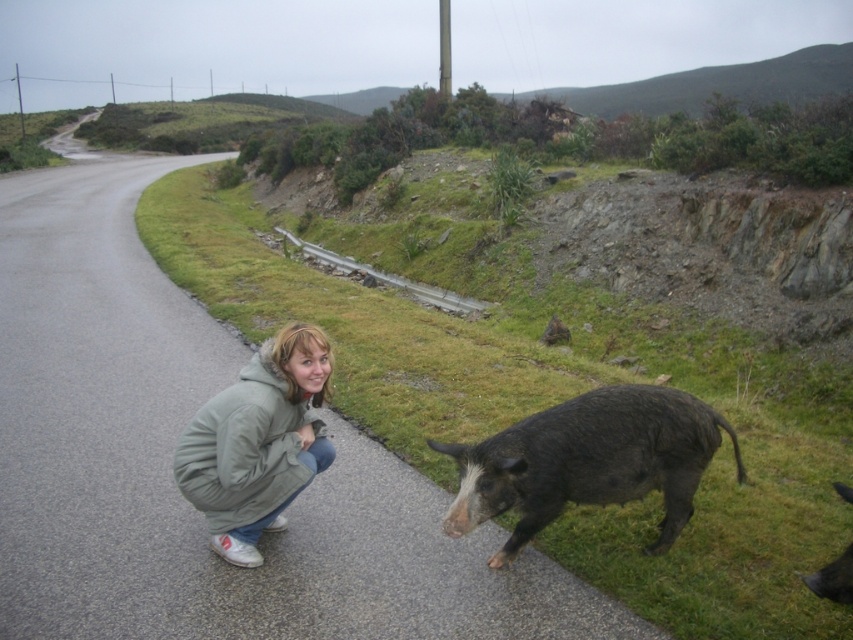
Question: Does green fuzzy jacket at lower left have a greater width compared to dark brown fur at lower right?

Choices:
 (A) no
 (B) yes

Answer: (B)

Question: Among these points, which one is nearest to the camera?

Choices:
 (A) (820, 582)
 (B) (444, 448)

Answer: (A)

Question: Which point is farther to the camera?

Choices:
 (A) green fuzzy jacket at lower left
 (B) dark brown fur at lower right
 (C) dark brown fur pig at road center

Answer: (A)

Question: Which point appears farthest from the camera in this image?

Choices:
 (A) (816, 582)
 (B) (207, 506)
 (C) (689, 502)

Answer: (C)

Question: Is dark brown fur pig at road center closer to the viewer compared to green fuzzy jacket at lower left?

Choices:
 (A) no
 (B) yes

Answer: (B)

Question: Can you confirm if green fuzzy jacket at lower left is bigger than dark brown fur at lower right?

Choices:
 (A) no
 (B) yes

Answer: (B)